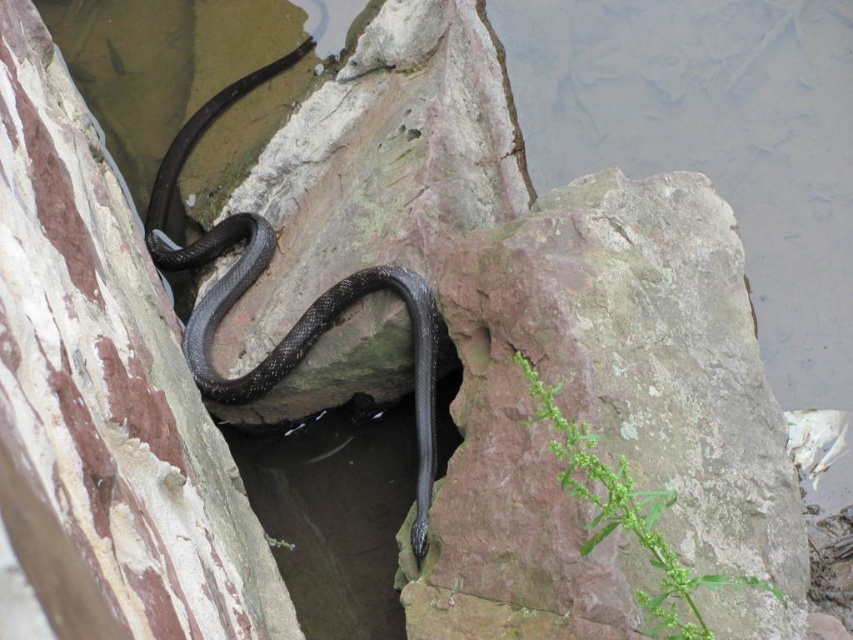
You are a hiker who wants to cross the water body. You see the rusty stone at center and the shiny black snake at center. Which object is taller so you can step on it?

The shiny black snake at center is taller than the rusty stone at center, so you can step on the shiny black snake at center.

You are standing at the origin point in the image. Where is the rusty stone at center located in terms of its 2D coordinates?

The rusty stone at center is located at the 2D coordinates of point (x=608, y=420).

You are a geologist examining the image. You notice a point marked at coordinates (608, 420). What object is located at that point?

The point at coordinates (608, 420) marks the rusty stone at center.